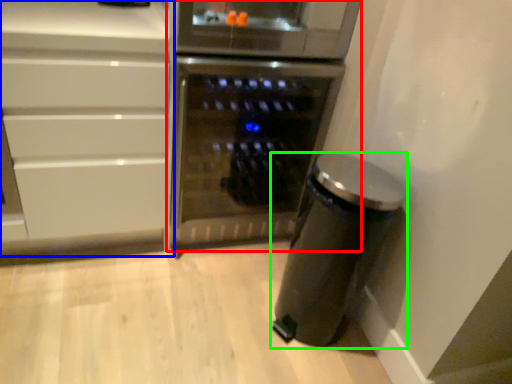
Question: Which is farther away from home appliance (highlighted by a red box)? cabinetry (highlighted by a blue box) or kitchen appliance (highlighted by a green box)?

Choices:
 (A) cabinetry
 (B) kitchen appliance

Answer: (B)